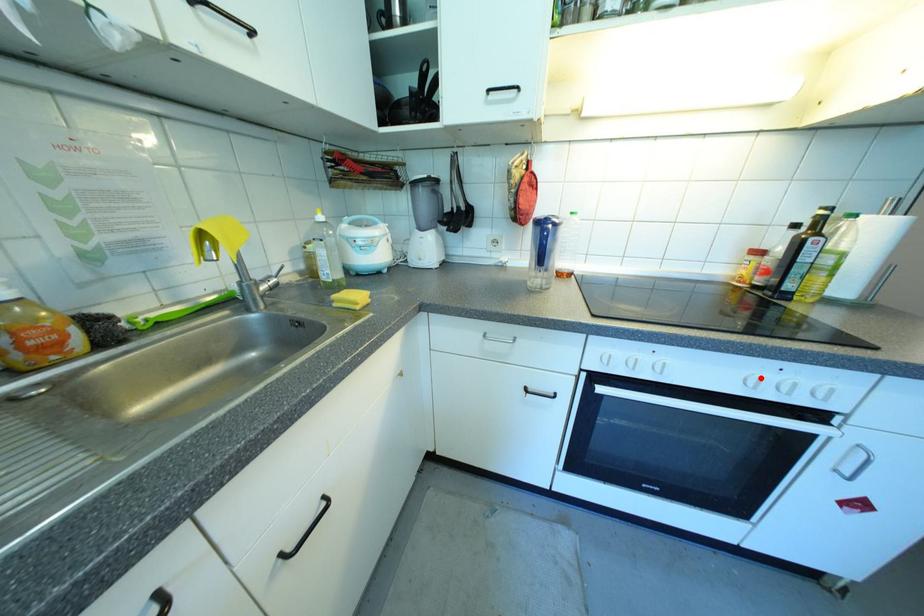
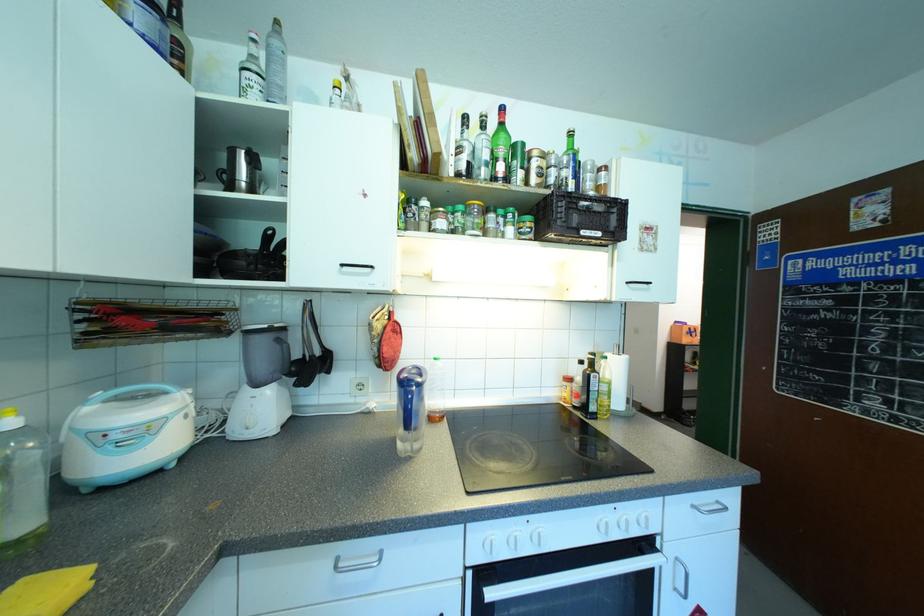
Where in the second image is the point corresponding to the highlighted location from the first image?

(606, 523)